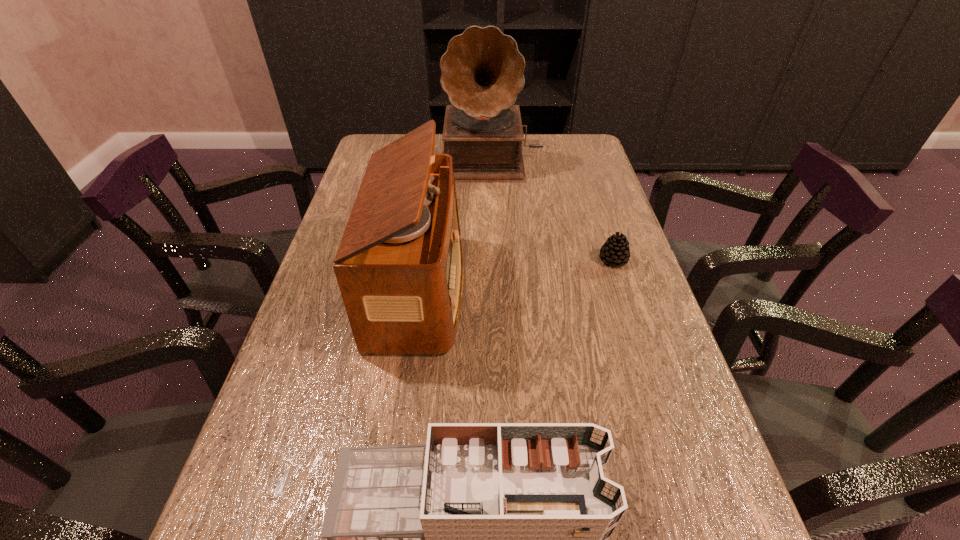
Image resolution: width=960 pixels, height=540 pixels. I want to click on object that stands as the second closest to the radio receiver, so click(x=482, y=70).

Locate an element on the screen. The height and width of the screenshot is (540, 960). free space that satisfies the following two spatial constraints: 1. from the horn of the record player; 2. on the front panel of the radio receiver is located at coordinates (497, 289).

Identify the location of vacant area that satisfies the following two spatial constraints: 1. from the horn of the record player; 2. on the front panel of the second tallest object. The height and width of the screenshot is (540, 960). (497, 289).